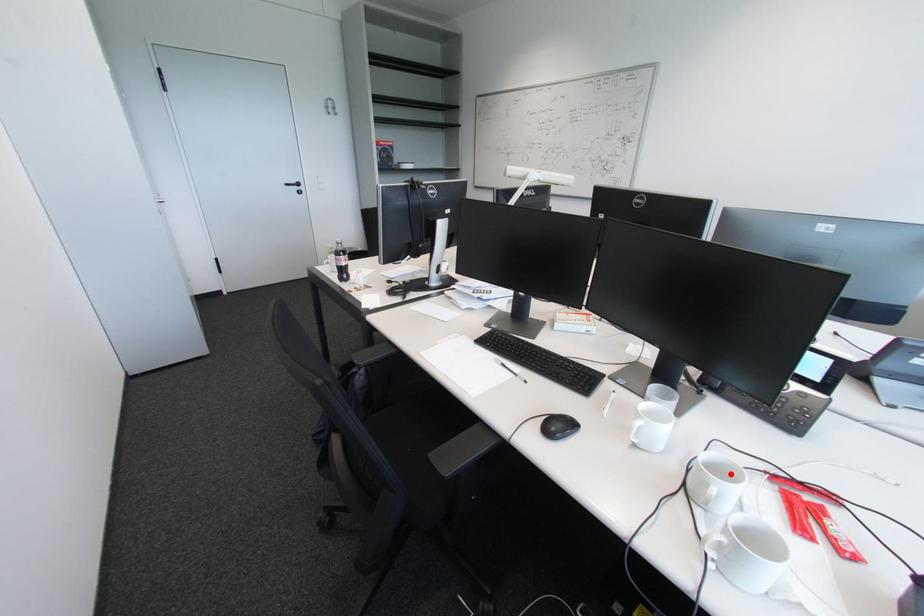
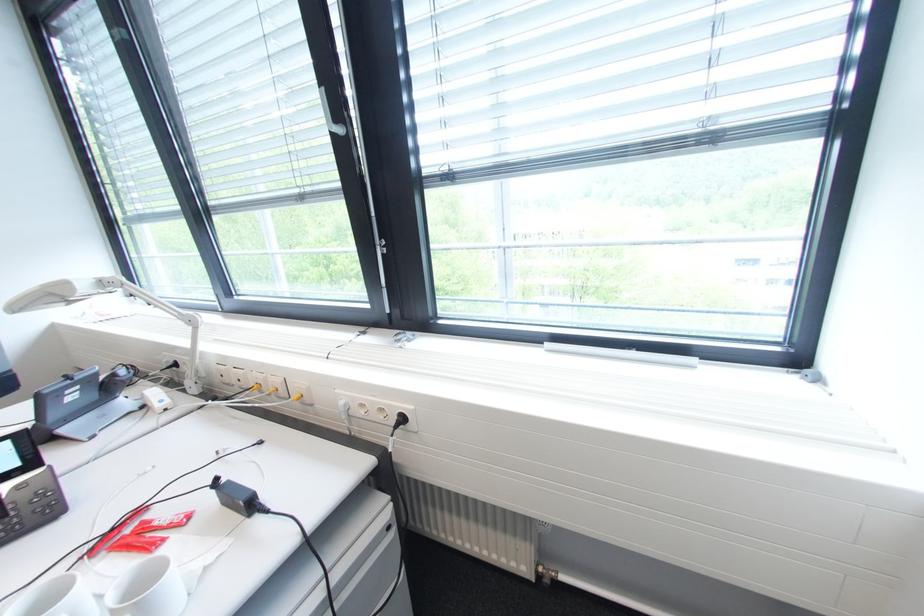
Locate, in the second image, the point that corresponds to the highlighted location in the first image.

(55, 601)